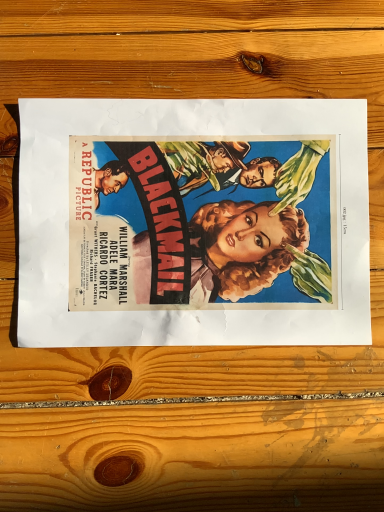
Locate an element on the screen. matte paper poster at center is located at coordinates (193, 223).

Measure the distance between matte paper poster at center and camera.

A distance of 13.87 inches exists between matte paper poster at center and camera.

Measure the distance between point (44, 271) and camera.

Point (44, 271) is 35.80 centimeters from camera.

This screenshot has height=512, width=384. What do you see at coordinates (193, 223) in the screenshot?
I see `matte paper poster at center` at bounding box center [193, 223].

Identify the location of matte paper poster at center. (193, 223).